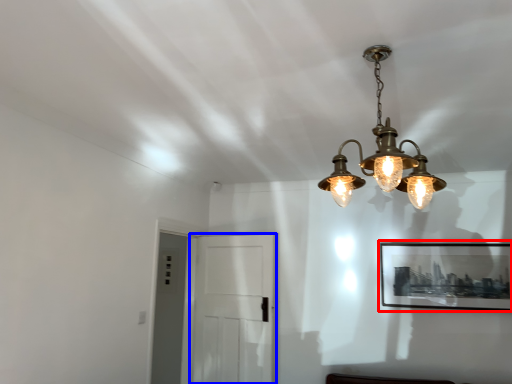
Question: Which object is closer to the camera taking this photo, picture frame (highlighted by a red box) or glass door (highlighted by a blue box)?

Choices:
 (A) picture frame
 (B) glass door

Answer: (B)